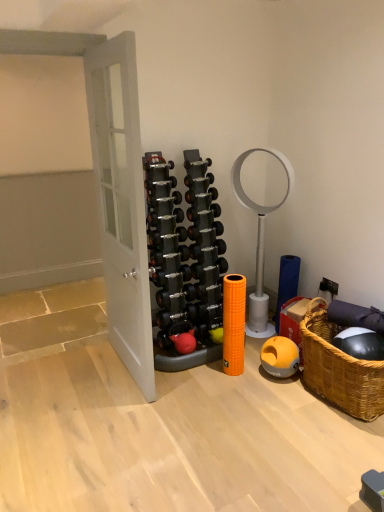
Find the location of a particular element. The width and height of the screenshot is (384, 512). vacant space that is to the left of brown woven picnic basket at lower right is located at coordinates (275, 407).